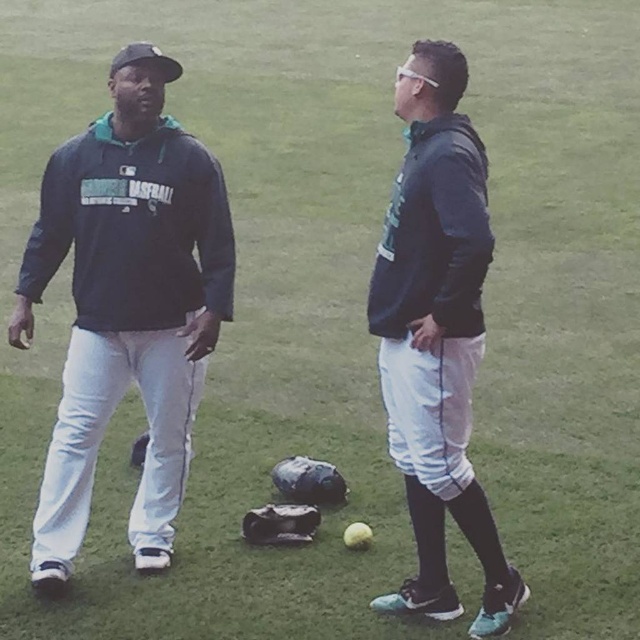
Question: Is matte black jacket at center positioned in front of dark gray leather glove at center?

Choices:
 (A) yes
 (B) no

Answer: (A)

Question: In this image, where is matte blue hoodie at left located relative to matte black jacket at center?

Choices:
 (A) above
 (B) below

Answer: (A)

Question: Which point is closer to the camera?

Choices:
 (A) leather textured glove at center
 (B) matte black jacket at center
 (C) matte blue hoodie at left
 (D) dark gray leather glove at center

Answer: (B)

Question: Among these objects, which one is nearest to the camera?

Choices:
 (A) leather textured glove at center
 (B) matte black jacket at center
 (C) dark gray leather glove at center
 (D) matte blue hoodie at left

Answer: (B)

Question: Which point is closer to the camera?

Choices:
 (A) matte black jacket at center
 (B) dark gray leather glove at center

Answer: (A)

Question: Is matte blue hoodie at left below matte black jacket at center?

Choices:
 (A) yes
 (B) no

Answer: (B)